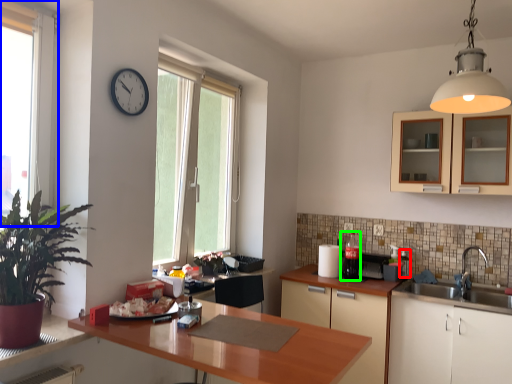
Question: Considering the real-world distances, which object is closest to appliance (highlighted by a red box)? window (highlighted by a blue box) or appliance (highlighted by a green box).

Choices:
 (A) window
 (B) appliance

Answer: (B)